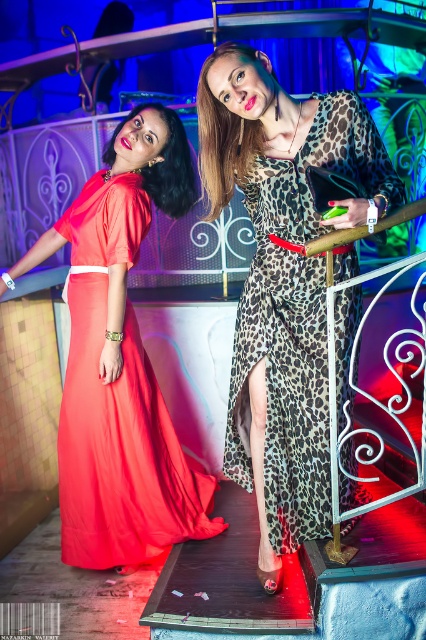
Is leopard print fabric dress at center closer to the viewer compared to matte red dress at upper left?

That is True.

Does leopard print fabric dress at center have a lesser width compared to matte red dress at upper left?

No.

I want to click on leopard print fabric dress at center, so click(x=296, y=320).

Consider the image. Who is more forward, (291,428) or (97,452)?

Positioned in front is point (291,428).

Is point (296, 300) farther from viewer compared to point (124, 436)?

No, it is in front of (124, 436).

I want to click on leopard print fabric dress at center, so pyautogui.click(x=296, y=320).

Is matte red dress at left taller than matte red dress at upper left?

Yes, matte red dress at left is taller than matte red dress at upper left.

Which is in front, point (164, 445) or point (106, 157)?

Point (106, 157) is in front.

Between point (178, 481) and point (164, 150), which one is positioned behind?

Positioned behind is point (178, 481).

This screenshot has width=426, height=640. Find the location of `matte red dress at left`. matte red dress at left is located at coordinates (118, 404).